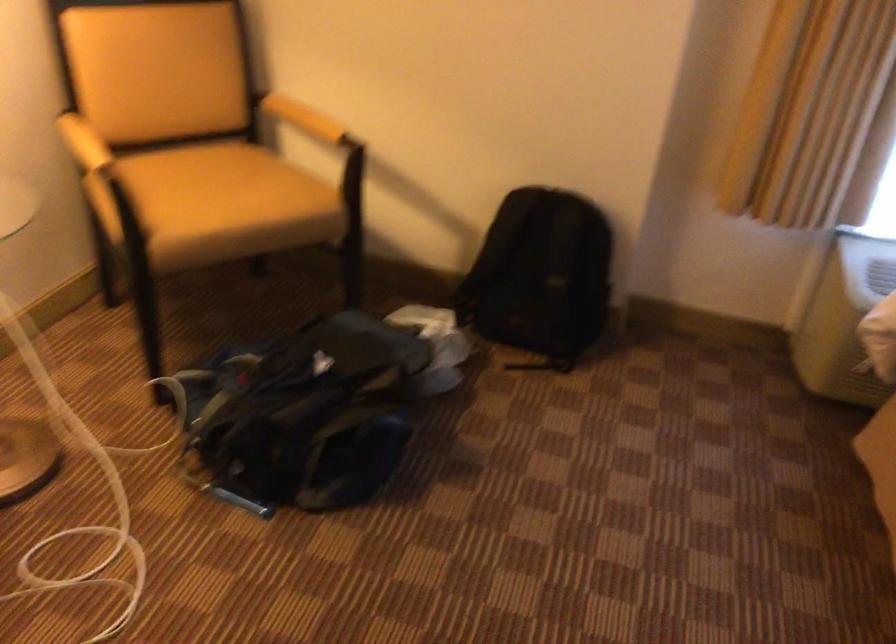
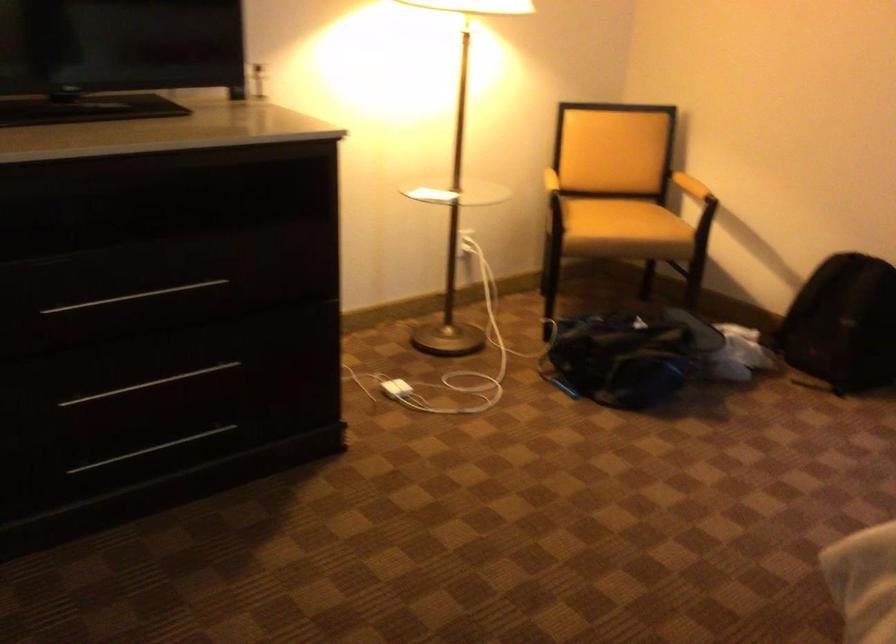
Where in the second image is the point corresponding to point (564, 301) from the first image?

(842, 324)